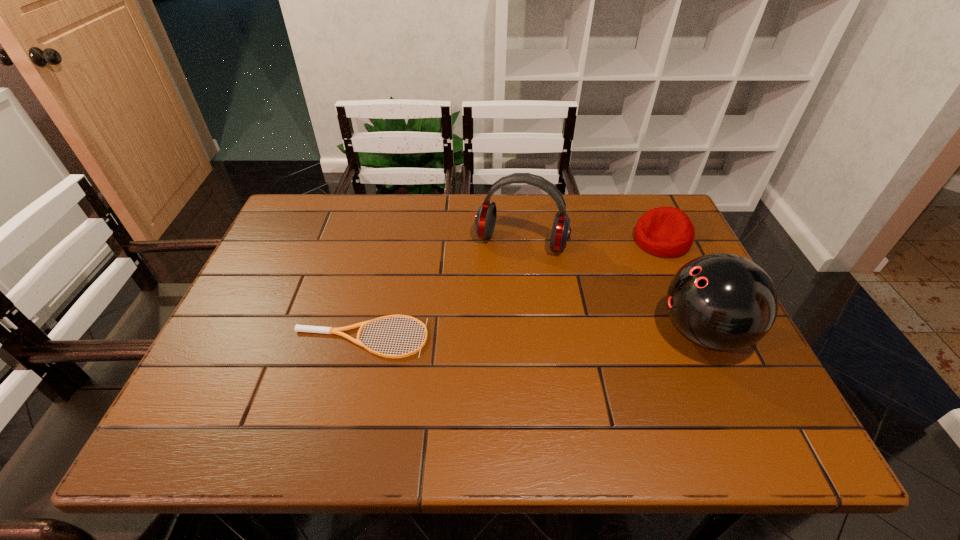
Locate an element on the screen. The image size is (960, 540). the shortest object is located at coordinates (298, 328).

Find the location of a particular element. This screenshot has width=960, height=540. tennis racket is located at coordinates (298, 328).

Find the location of `bowling ball`. bowling ball is located at coordinates (721, 302).

This screenshot has height=540, width=960. I want to click on earphone, so click(485, 219).

In order to click on the second shortest object in this screenshot , I will do `click(668, 232)`.

At what (x,y) coordinates should I click in order to perform the action: click on free space located 0.100m on the left of the tennis racket. Please return your answer as a coordinate pair (x, y). This screenshot has width=960, height=540. Looking at the image, I should click on (251, 338).

At what (x,y) coordinates should I click in order to perform the action: click on free space located on the surface of the bowling ball near the finger holes. Please return your answer as a coordinate pair (x, y). The image size is (960, 540). Looking at the image, I should click on (613, 334).

Where is `free region located 0.130m on the surface of the bowling ball near the finger holes`? free region located 0.130m on the surface of the bowling ball near the finger holes is located at coordinates (601, 334).

The height and width of the screenshot is (540, 960). Find the location of `blank space located 0.280m on the surface of the bowling ball near the finger holes`. blank space located 0.280m on the surface of the bowling ball near the finger holes is located at coordinates [x=536, y=334].

Where is `blank space located on the ear cups of the earphone`? blank space located on the ear cups of the earphone is located at coordinates (491, 320).